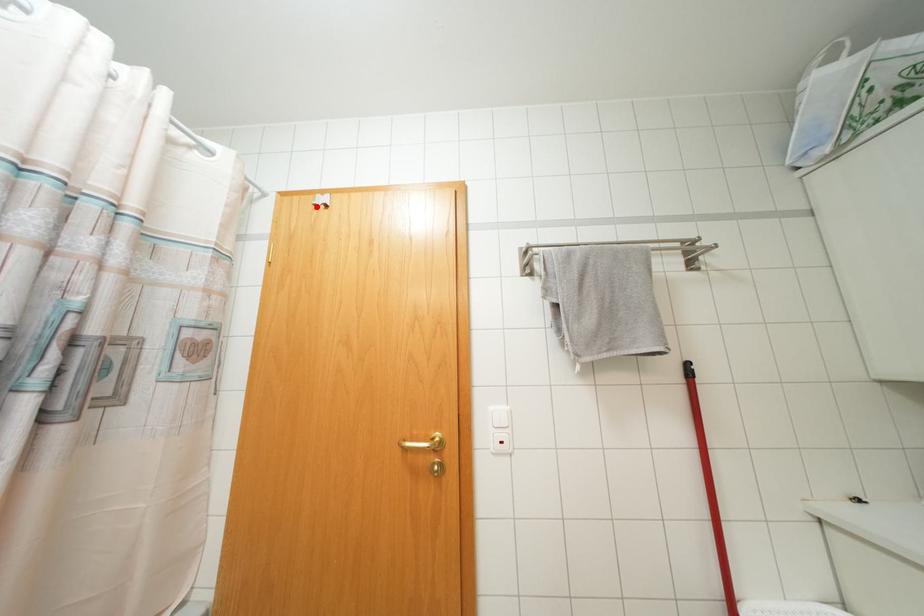
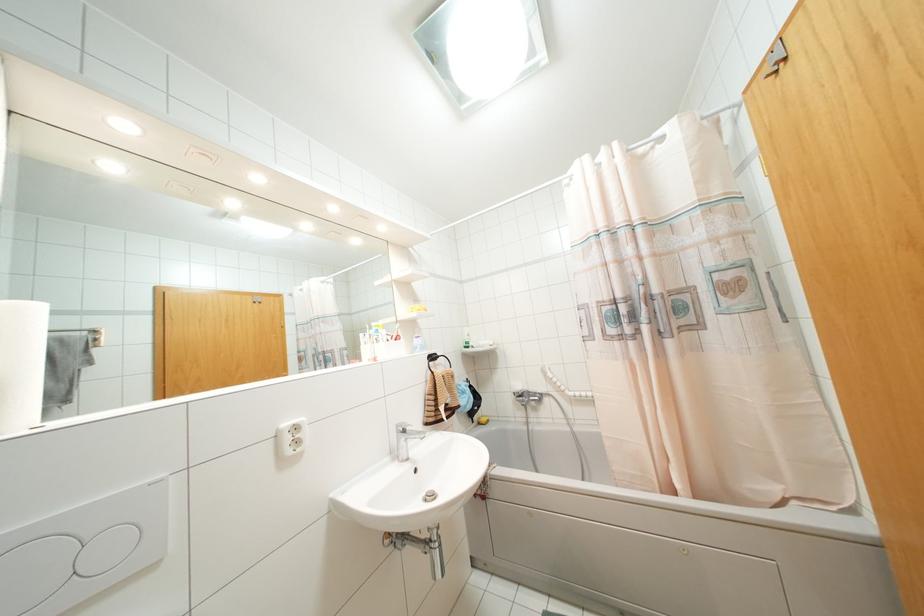
Locate, in the second image, the point that corresponds to the highlighted location in the first image.

(775, 71)